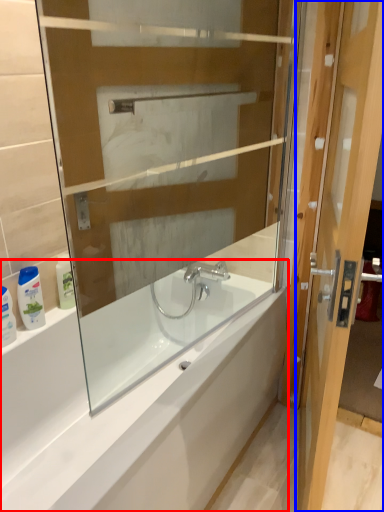
Question: Among these objects, which one is farthest to the camera, bathtub (highlighted by a red box) or door (highlighted by a blue box)?

Choices:
 (A) bathtub
 (B) door

Answer: (A)